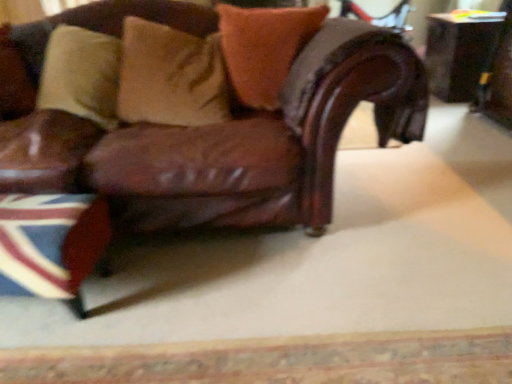
Identify the location of wooden table at right. (460, 52).

Image resolution: width=512 pixels, height=384 pixels. What are the coordinates of `shiny black swivel chair at upper right` in the screenshot? It's located at (497, 79).

What do you see at coordinates (50, 242) in the screenshot?
I see `union jack fabric at lower left` at bounding box center [50, 242].

Measure the distance between velvet orange pillow at upper center, which is counted as the first pillow, starting from the right, and camera.

velvet orange pillow at upper center, which is counted as the first pillow, starting from the right, is 1.84 meters away from camera.

The image size is (512, 384). Describe the element at coordinates (251, 144) in the screenshot. I see `brown leather chair at center` at that location.

Where is `wooden table at right`? The image size is (512, 384). wooden table at right is located at coordinates (460, 52).

Is shiny black swivel chair at upper right at the right side of wooden table at right?

In fact, shiny black swivel chair at upper right is to the left of wooden table at right.

Locate an element on the screen. The height and width of the screenshot is (384, 512). swivel chair above the wooden table at right (from a real-world perspective) is located at coordinates (497, 79).

Who is taller, shiny black swivel chair at upper right or wooden table at right?

shiny black swivel chair at upper right is taller.

From a real-world perspective, which is physically below, shiny black swivel chair at upper right or wooden table at right?

wooden table at right, from a real-world perspective.

Can you confirm if union jack fabric at lower left is bigger than brown leather chair at center?

Actually, union jack fabric at lower left might be smaller than brown leather chair at center.

Is union jack fabric at lower left facing away from brown leather chair at center?

Yes, union jack fabric at lower left's orientation is away from brown leather chair at center.

Considering the relative sizes of union jack fabric at lower left and brown leather chair at center in the image provided, is union jack fabric at lower left wider than brown leather chair at center?

No.

How much distance is there between union jack fabric at lower left and brown leather chair at center?

15.00 inches.

Looking at their sizes, would you say velvet orange pillow at upper center, which is counted as the first pillow, starting from the right, is wider or thinner than union jack fabric at lower left?

Clearly, velvet orange pillow at upper center, which is counted as the first pillow, starting from the right, has less width compared to union jack fabric at lower left.

From a real-world perspective, between velvet orange pillow at upper center, which ranks as the third pillow in left-to-right order, and union jack fabric at lower left, who is vertically lower?

From a 3D spatial view, union jack fabric at lower left is below.

Does velvet orange pillow at upper center, which ranks as the third pillow in left-to-right order, have a lesser height compared to union jack fabric at lower left?

Incorrect, the height of velvet orange pillow at upper center, which ranks as the third pillow in left-to-right order, does not fall short of that of union jack fabric at lower left.

Measure the distance from velvet orange pillow at upper center, which ranks as the third pillow in left-to-right order, to union jack fabric at lower left.

A distance of 1.01 meters exists between velvet orange pillow at upper center, which ranks as the third pillow in left-to-right order, and union jack fabric at lower left.

Can you confirm if brown leather chair at center is positioned to the left of brown leather pillow at upper left, the first pillow from the left?

Incorrect, brown leather chair at center is not on the left side of brown leather pillow at upper left, the first pillow from the left.

Is brown leather chair at center facing towards brown leather pillow at upper left, the first pillow from the left?

No, brown leather chair at center is not facing towards brown leather pillow at upper left, the first pillow from the left.

Which is behind, brown leather chair at center or shiny black swivel chair at upper right?

shiny black swivel chair at upper right.

Could you tell me if brown leather chair at center is turned towards shiny black swivel chair at upper right?

No, brown leather chair at center is not oriented towards shiny black swivel chair at upper right.

From the picture: Can you tell me how much brown leather chair at center and shiny black swivel chair at upper right differ in facing direction?

The angle between the facing direction of brown leather chair at center and the facing direction of shiny black swivel chair at upper right is 95.2 degrees.

Looking at this image, which object is positioned more to the right, brown leather chair at center or shiny black swivel chair at upper right?

shiny black swivel chair at upper right is more to the right.

Which point is more forward, (466, 80) or (494, 52)?

The point (494, 52) is closer.

Identify the location of swivel chair located below the wooden table at right (from the image's perspective). (497, 79).

From the image's perspective, is wooden table at right on top of shiny black swivel chair at upper right?

Indeed, from the image's perspective, wooden table at right is shown above shiny black swivel chair at upper right.

From a real-world perspective, is suede-like beige pillow at upper center, positioned as the second pillow in left-to-right order, over brown leather pillow at upper left, the 3th pillow positioned from the right?

Actually, suede-like beige pillow at upper center, positioned as the second pillow in left-to-right order, is physically below brown leather pillow at upper left, the 3th pillow positioned from the right, in the real world.

From the image's perspective, is suede-like beige pillow at upper center, which is the 2th pillow in right-to-left order, below brown leather pillow at upper left, the first pillow from the left?

Yes, from the image's perspective, suede-like beige pillow at upper center, which is the 2th pillow in right-to-left order, is below brown leather pillow at upper left, the first pillow from the left.

Is suede-like beige pillow at upper center, which is the 2th pillow in right-to-left order, far away from brown leather pillow at upper left, the first pillow from the left?

suede-like beige pillow at upper center, which is the 2th pillow in right-to-left order, is actually quite close to brown leather pillow at upper left, the first pillow from the left.

Is suede-like beige pillow at upper center, which is the 2th pillow in right-to-left order, oriented towards brown leather pillow at upper left, the first pillow from the left?

No, suede-like beige pillow at upper center, which is the 2th pillow in right-to-left order, is not aimed at brown leather pillow at upper left, the first pillow from the left.

Locate an element on the screen. This screenshot has height=384, width=512. swivel chair positioned vertically above the wooden table at right (from a real-world perspective) is located at coordinates (497, 79).

In the image, there is a brown leather chair at center. Where is `flag below it (from the image's perspective)`? This screenshot has height=384, width=512. flag below it (from the image's perspective) is located at coordinates (50, 242).

Based on their spatial positions, is velvet orange pillow at upper center, which ranks as the third pillow in left-to-right order, or wooden table at right further from shiny black swivel chair at upper right?

velvet orange pillow at upper center, which ranks as the third pillow in left-to-right order, is further to shiny black swivel chair at upper right.

Based on their spatial positions, is velvet orange pillow at upper center, which ranks as the third pillow in left-to-right order, or wooden table at right further from brown leather pillow at upper left, the 3th pillow positioned from the right?

wooden table at right.

Looking at the image, which one is located further to shiny black swivel chair at upper right, union jack fabric at lower left or wooden table at right?

The object further to shiny black swivel chair at upper right is union jack fabric at lower left.

When comparing their distances from shiny black swivel chair at upper right, does brown leather chair at center or brown leather pillow at upper left, the first pillow from the left, seem further?

brown leather pillow at upper left, the first pillow from the left.

Considering their positions, is suede-like beige pillow at upper center, positioned as the second pillow in left-to-right order, positioned closer to brown leather chair at center than shiny black swivel chair at upper right?

suede-like beige pillow at upper center, positioned as the second pillow in left-to-right order.

From the image, which object appears to be nearer to velvet orange pillow at upper center, which ranks as the third pillow in left-to-right order, union jack fabric at lower left or brown leather pillow at upper left, the 3th pillow positioned from the right?

union jack fabric at lower left lies closer to velvet orange pillow at upper center, which ranks as the third pillow in left-to-right order, than the other object.

When comparing their distances from wooden table at right, does suede-like beige pillow at upper center, positioned as the second pillow in left-to-right order, or brown leather pillow at upper left, the 3th pillow positioned from the right, seem closer?

suede-like beige pillow at upper center, positioned as the second pillow in left-to-right order, is closer to wooden table at right.

From the image, which object appears to be nearer to suede-like beige pillow at upper center, positioned as the second pillow in left-to-right order, shiny black swivel chair at upper right or brown leather chair at center?

Among the two, brown leather chair at center is located nearer to suede-like beige pillow at upper center, positioned as the second pillow in left-to-right order.

You are a GUI agent. You are given a task and a screenshot of the screen. Output one action in this format:
    pyautogui.click(x=<x>, y=<y>)
    Task: Click on the chair between union jack fabric at lower left and wooden table at right
    Image resolution: width=512 pixels, height=384 pixels.
    Given the screenshot: What is the action you would take?
    pyautogui.click(x=251, y=144)

I want to click on flag situated between brown leather pillow at upper left, the 3th pillow positioned from the right, and wooden table at right from left to right, so point(50,242).

I want to click on chair between union jack fabric at lower left and shiny black swivel chair at upper right, so click(251, 144).

The image size is (512, 384). What are the coordinates of `swivel chair between brown leather chair at center and wooden table at right in the horizontal direction` in the screenshot? It's located at (497, 79).